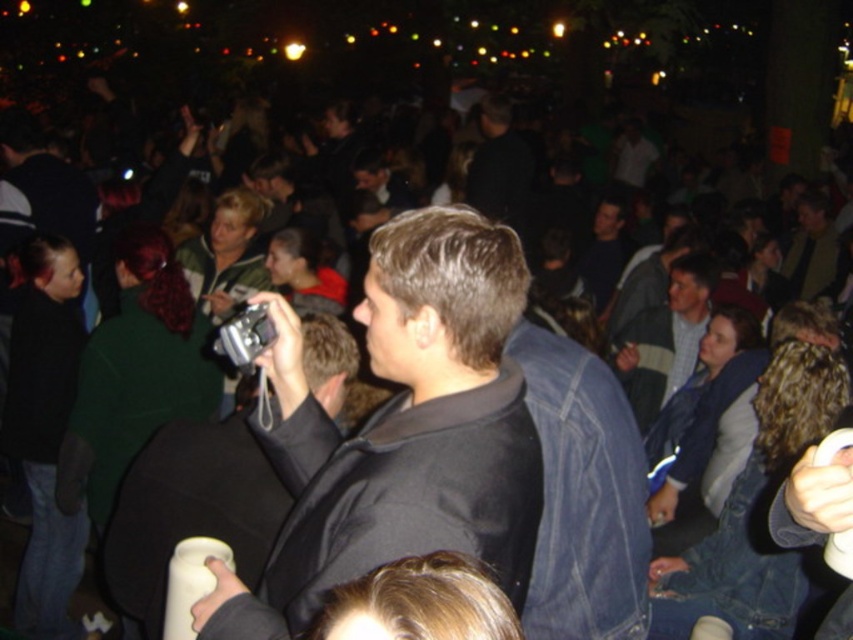
You are a photographer at the event and want to ensure both the light gray sweater at center and the dark blue shirt at center are visible in your photo. Since you can only focus on one subject, which one should you choose to ensure the other remains in the background?

The light gray sweater at center is taller than the dark blue shirt at center, so you should focus on the light gray sweater at center to ensure the shorter dark blue shirt at center remains in the background.

You are standing at the point with coordinates point (486,310) and want to take a photo of the camera. Can you reach the camera without moving from your current position?

The distance between point (486,310) and the camera is 4.63 feet, so you cannot reach the camera without moving from your current position since the distance is too far.